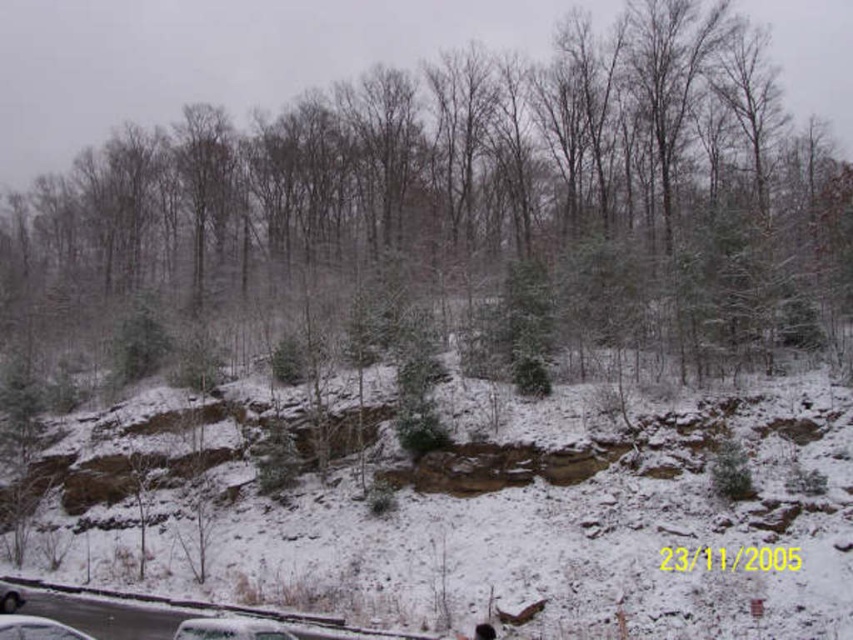
Find the location of a particular element. The image size is (853, 640). snowy rock at center is located at coordinates (521, 525).

Can you confirm if snowy rock at center is taller than white snow-covered highway at lower left?

Correct, snowy rock at center is much taller as white snow-covered highway at lower left.

Measure the distance between point (492, 449) and camera.

A distance of 32.31 meters exists between point (492, 449) and camera.

The height and width of the screenshot is (640, 853). Identify the location of snowy rock at center. (521, 525).

Between white snow-covered highway at lower left and white glossy car at lower center, which one is positioned higher?

Positioned higher is white glossy car at lower center.

Locate an element on the screen. white snow-covered highway at lower left is located at coordinates pyautogui.click(x=209, y=605).

Identify the location of white snow-covered highway at lower left. (209, 605).

Is white glossy car at lower center thinner than white matte car at lower left?

Yes, white glossy car at lower center is thinner than white matte car at lower left.

Between point (258, 628) and point (39, 618), which one is positioned behind?

The point (39, 618) is behind.

Is point (189, 620) more distant than point (3, 628)?

Yes, it is.

Find the location of a particular element. white glossy car at lower center is located at coordinates (231, 628).